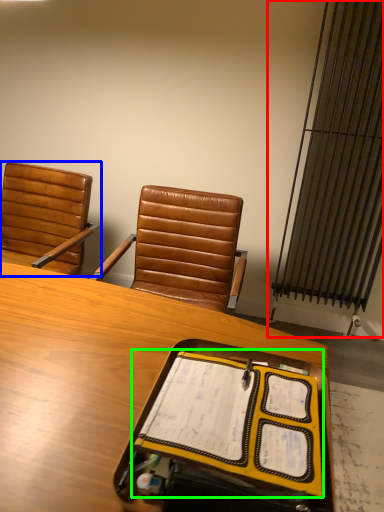
Question: Which object is positioned farthest from radiator (highlighted by a red box)? Select from chair (highlighted by a blue box) and notebook (highlighted by a green box).

Choices:
 (A) chair
 (B) notebook

Answer: (B)